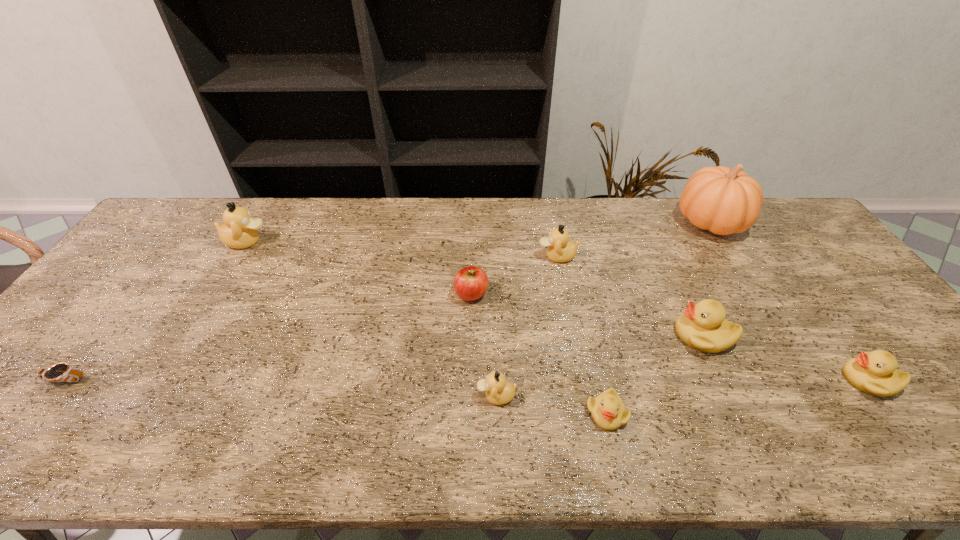
I want to click on free space at the near edge of the desktop, so click(67, 436).

In the image, there is a desktop. Where is `free space at the left edge`? free space at the left edge is located at coordinates (111, 297).

Find the location of a particular element. vacant space at the right edge of the desktop is located at coordinates (834, 302).

In order to click on free space between the biggest tan duckling and the rightmost duckling in this screenshot , I will do `click(558, 310)`.

Identify the location of free space between the eighth tallest object and the apple. (539, 354).

Where is `vacant space in between the second tan duckling from left to right and the sixth nearest object`? The height and width of the screenshot is (540, 960). vacant space in between the second tan duckling from left to right and the sixth nearest object is located at coordinates (484, 345).

You are a GUI agent. You are given a task and a screenshot of the screen. Output one action in this format:
    pyautogui.click(x=<x>, y=<y>)
    Task: Click on the free space that is in between the second shortest object and the biggest tan duckling
    The height and width of the screenshot is (540, 960).
    Given the screenshot: What is the action you would take?
    pyautogui.click(x=426, y=327)

Identify the location of vacant space that is in between the rightmost duckling and the fifth nearest object. The height and width of the screenshot is (540, 960). [786, 357].

Identify the location of vacant space in between the orange pumpkin and the eighth shortest object. (479, 232).

Find the location of a particular element. This screenshot has height=540, width=960. empty location between the fourth nearest duckling and the tallest object is located at coordinates (708, 279).